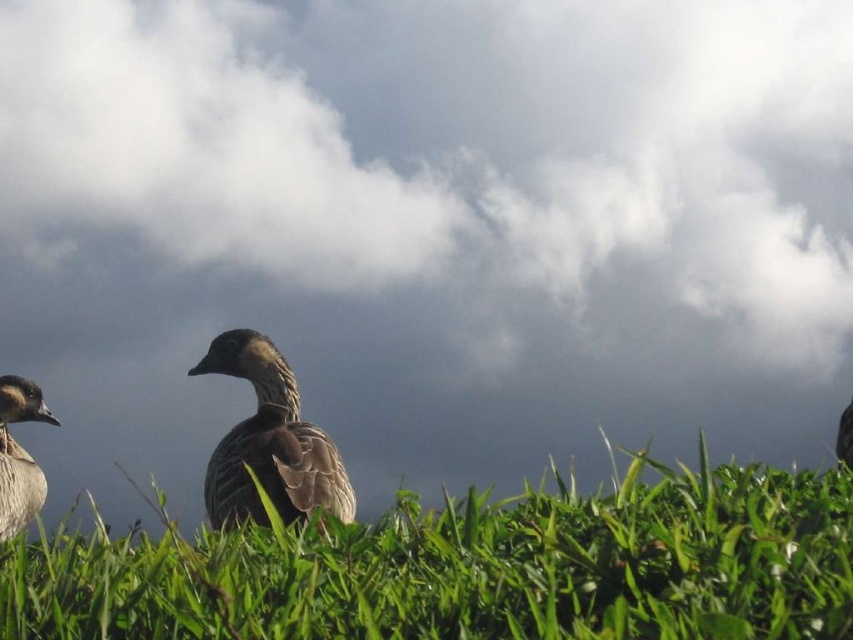
Question: Can you confirm if green grassy at center is positioned to the right of brown feathered duck at center?

Choices:
 (A) yes
 (B) no

Answer: (A)

Question: Does brown feathered duck at center have a greater width compared to brown feathered duck at left?

Choices:
 (A) no
 (B) yes

Answer: (B)

Question: Which object is closer to the camera taking this photo?

Choices:
 (A) brown feathered duck at center
 (B) brown feathered duck at left
 (C) green grassy at center

Answer: (C)

Question: Estimate the real-world distances between objects in this image. Which object is closer to the brown feathered duck at center?

Choices:
 (A) green grassy at center
 (B) brown feathered duck at left

Answer: (B)

Question: Where is green grassy at center located in relation to brown feathered duck at left in the image?

Choices:
 (A) below
 (B) above

Answer: (B)

Question: Which object is closer to the camera taking this photo?

Choices:
 (A) brown feathered duck at left
 (B) brown feathered duck at center

Answer: (B)